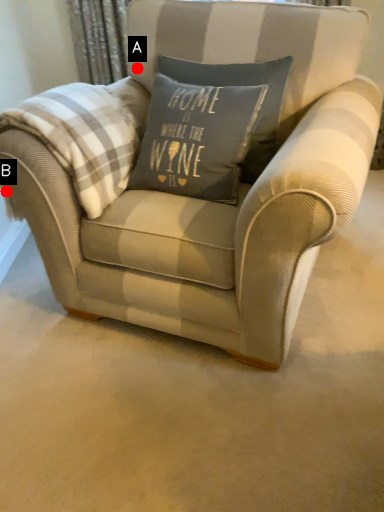
Question: Two points are circled on the image, labeled by A and B beside each circle. Which point is farther to the camera?

Choices:
 (A) A is further
 (B) B is further

Answer: (A)